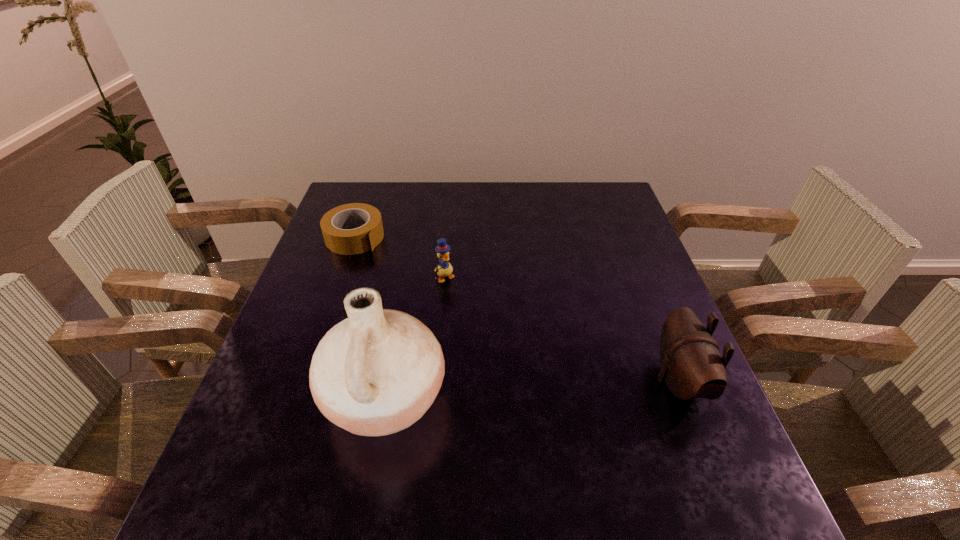
Locate an element on the screen. free space on the desktop that is between the pottery and the second tallest object and is positioned on the face of the duckling, where the monocle is placed is located at coordinates (540, 388).

The height and width of the screenshot is (540, 960). In order to click on free space on the desktop that is between the pottery and the rightmost object and is positioned at the edge of the shortest object in this screenshot , I will do `click(566, 387)`.